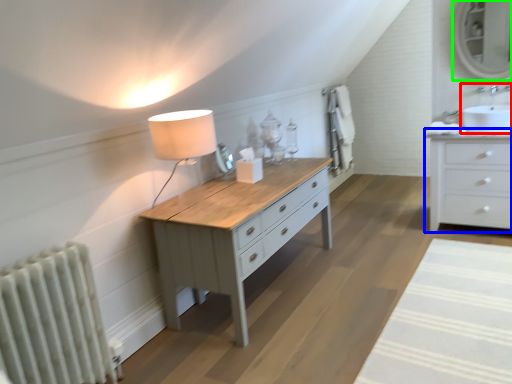
Question: Which object is the closest to the sink (highlighted by a red box)? Choose among these: chest of drawers (highlighted by a blue box) or mirror (highlighted by a green box).

Choices:
 (A) chest of drawers
 (B) mirror

Answer: (A)